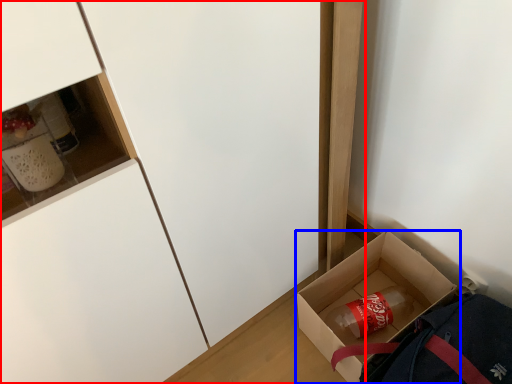
Question: Which point is further to the camera, cabinetry (highlighted by a red box) or box (highlighted by a blue box)?

Choices:
 (A) cabinetry
 (B) box

Answer: (B)